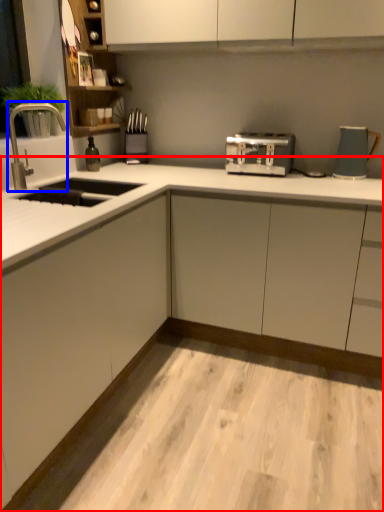
Question: Among these objects, which one is farthest to the camera, countertop (highlighted by a red box) or tap (highlighted by a blue box)?

Choices:
 (A) countertop
 (B) tap

Answer: (B)